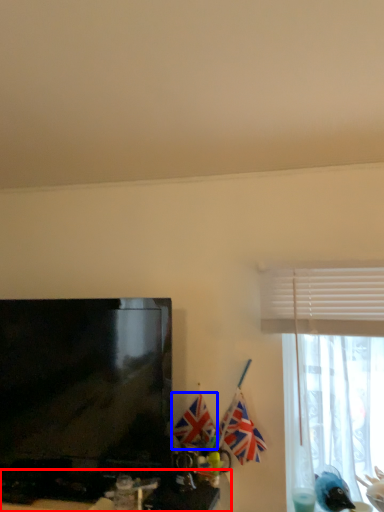
Question: Which of the following is the closest to the observer, computer desk (highlighted by a red box) or flag (highlighted by a blue box)?

Choices:
 (A) computer desk
 (B) flag

Answer: (A)